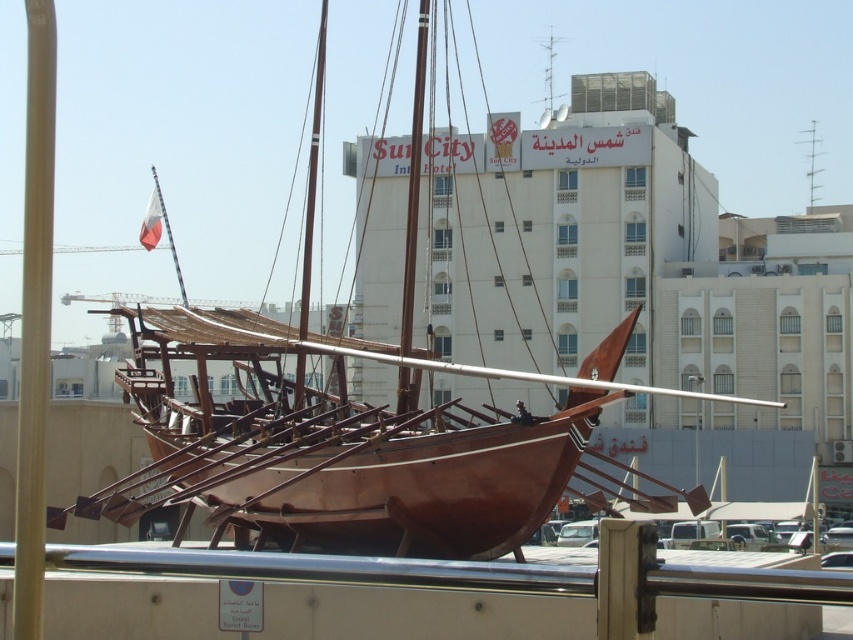
Question: Considering the relative positions of wooden mast at center and brown wooden mast at upper center in the image provided, where is wooden mast at center located with respect to brown wooden mast at upper center?

Choices:
 (A) right
 (B) left

Answer: (B)

Question: Which object is farther from the camera taking this photo?

Choices:
 (A) wooden mast at left
 (B) brown wooden mast at upper center
 (C) wooden mast at center

Answer: (B)

Question: Among these objects, which one is farthest from the camera?

Choices:
 (A) brown wooden mast at center
 (B) wooden mast at center
 (C) wooden mast at left

Answer: (A)

Question: Considering the relative positions of wooden mast at left and brown wooden mast at center in the image provided, where is wooden mast at left located with respect to brown wooden mast at center?

Choices:
 (A) below
 (B) above

Answer: (A)

Question: Can you confirm if wooden mast at left is positioned above wooden mast at center?

Choices:
 (A) yes
 (B) no

Answer: (B)

Question: Which object is the closest to the brown wooden mast at upper center?

Choices:
 (A) brown wooden mast at center
 (B) wooden mast at left
 (C) wooden mast at center

Answer: (A)